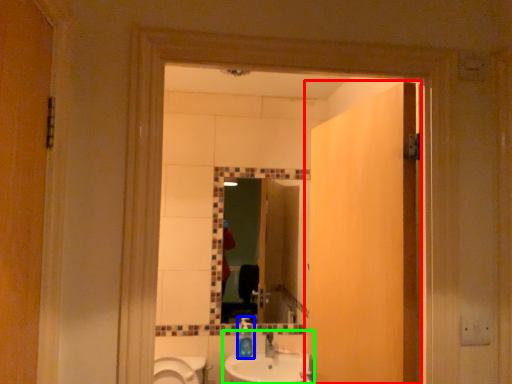
Question: Which object is positioned farthest from door (highlighted by a red box)? Select from bottle (highlighted by a blue box) and sink (highlighted by a green box).

Choices:
 (A) bottle
 (B) sink

Answer: (A)